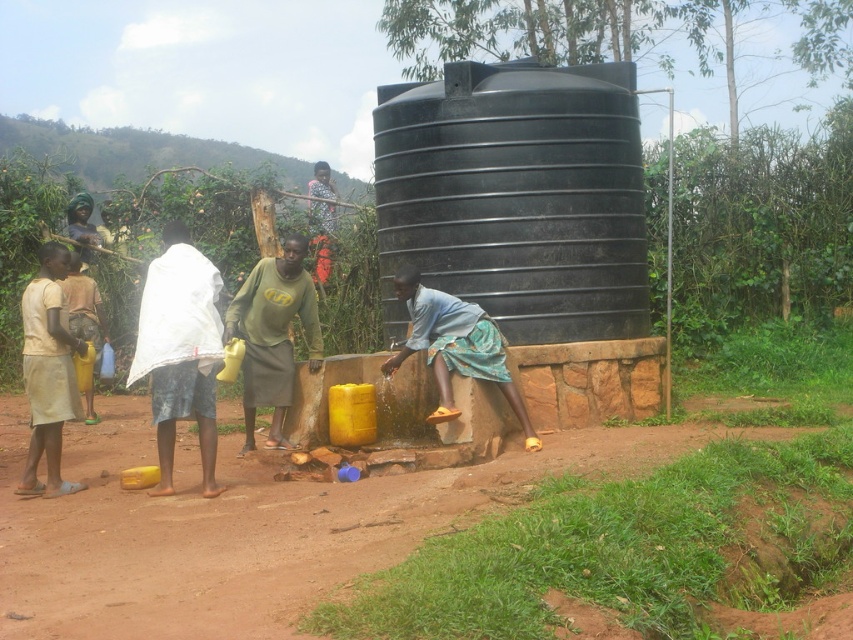
In the scene shown: In the scene described, there are two individuals wearing shirts of different colors. The first is wearing a green matte shirt at center, and the second is wearing a light beige fabric shirt at left. Based on their positions, which shirt is positioned more to the right side of the image?

The green matte shirt at center is positioned more to the right side of the image compared to the light beige fabric shirt at left.

You are a visitor observing the scene. You notice the green matte shirt at center and the matte yellow jug at left. Which object is higher in position compared to the other?

The green matte shirt at center is taller than the matte yellow jug at left.

Looking at this image, you are standing in a rural area with a large black water tank. You see a green matte shirt at center and a light beige fabric shirt at left. Which shirt is higher up relative to the other?

The green matte shirt at center is above the light beige fabric shirt at left.